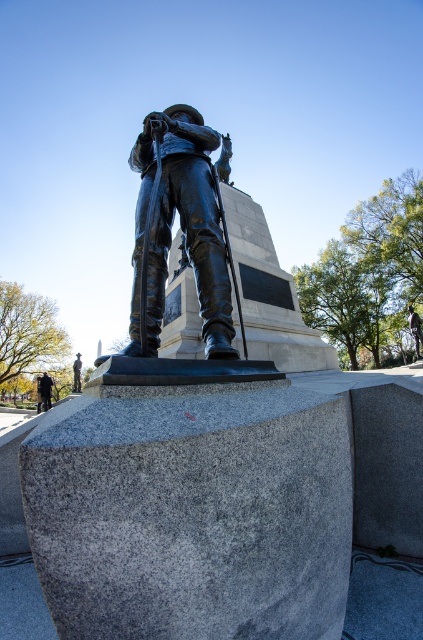
Can you confirm if bronze statue at center is thinner than dark brown leather jacket at lower left?

Indeed, bronze statue at center has a lesser width compared to dark brown leather jacket at lower left.

Between point (208, 321) and point (49, 397), which one is positioned in front?

Point (208, 321) is in front.

At what (x,y) coordinates should I click in order to perform the action: click on bronze statue at center. Please return your answer as a coordinate pair (x, y). The width and height of the screenshot is (423, 640). Looking at the image, I should click on (181, 227).